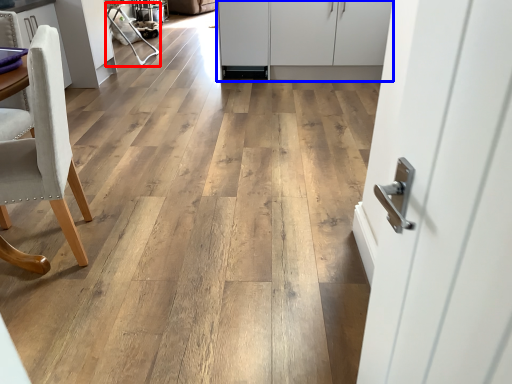
Question: Which object appears closest to the camera in this image, armchair (highlighted by a red box) or cabinetry (highlighted by a blue box)?

Choices:
 (A) armchair
 (B) cabinetry

Answer: (B)